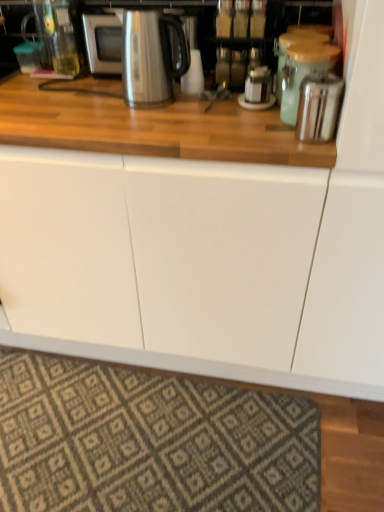
The width and height of the screenshot is (384, 512). In order to click on blank space above patterned carpet at lower center (from a real-world perspective) in this screenshot , I will do `click(125, 432)`.